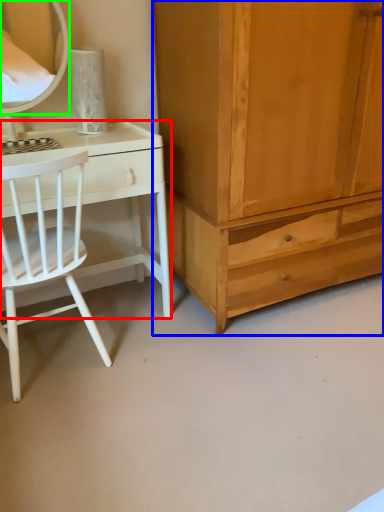
Question: Considering the real-world distances, which object is farthest from desk (highlighted by a red box)? cabinetry (highlighted by a blue box) or mirror (highlighted by a green box)?

Choices:
 (A) cabinetry
 (B) mirror

Answer: (B)